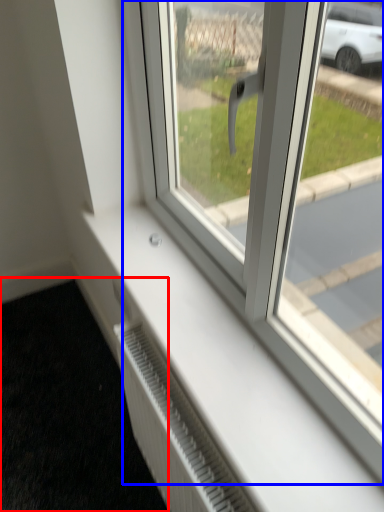
Question: Among these objects, which one is nearest to the camera, pavement (highlighted by a red box) or window (highlighted by a blue box)?

Choices:
 (A) pavement
 (B) window

Answer: (B)